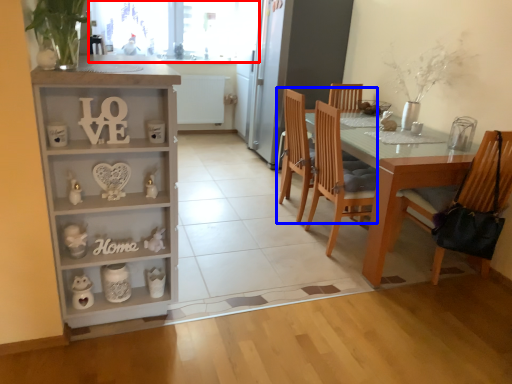
Question: Which object appears farthest to the camera in this image, window screen (highlighted by a red box) or chair (highlighted by a blue box)?

Choices:
 (A) window screen
 (B) chair

Answer: (A)